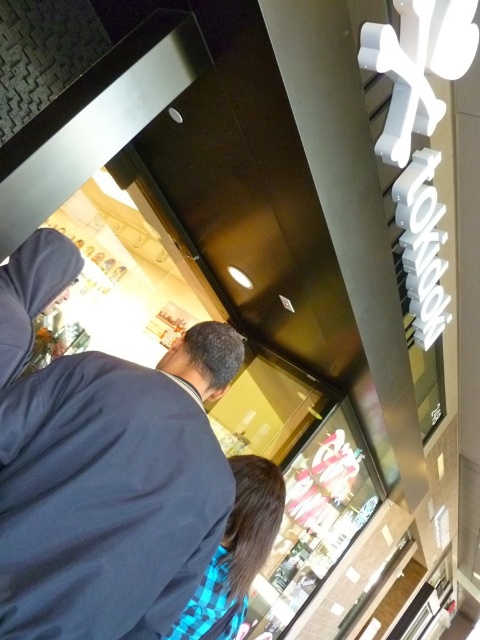
Question: Is the position of dark blue fabric at center less distant than that of blue plaid shirt at lower center?

Choices:
 (A) yes
 (B) no

Answer: (A)

Question: Is the position of dark blue fabric at center more distant than that of blue plaid shirt at lower center?

Choices:
 (A) no
 (B) yes

Answer: (A)

Question: Does dark blue fabric at center appear under blue plaid shirt at lower center?

Choices:
 (A) no
 (B) yes

Answer: (A)